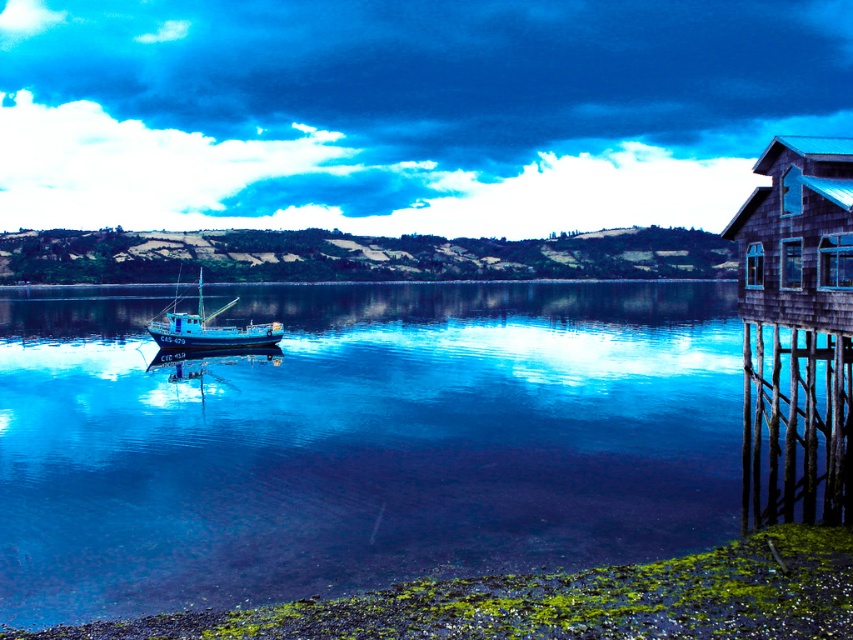
From the picture: You are planning to take a photo of the wooden cabin at right and the blue matte fishing boat at center from a position where both are visible. Based on their heights, which object will appear taller in the photo?

The blue matte fishing boat at center will appear taller in the photo because it is taller than the wooden cabin at right.

You are standing at the lakeside and want to reach the wooden cabin at right. Given that you walk at a speed of 3 feet per second, how long will it take you to reach the cabin?

The wooden cabin at right is 57.94 feet away from the camera. At a walking speed of 3 feet per second, it would take approximately 19.31 seconds to reach the cabin.